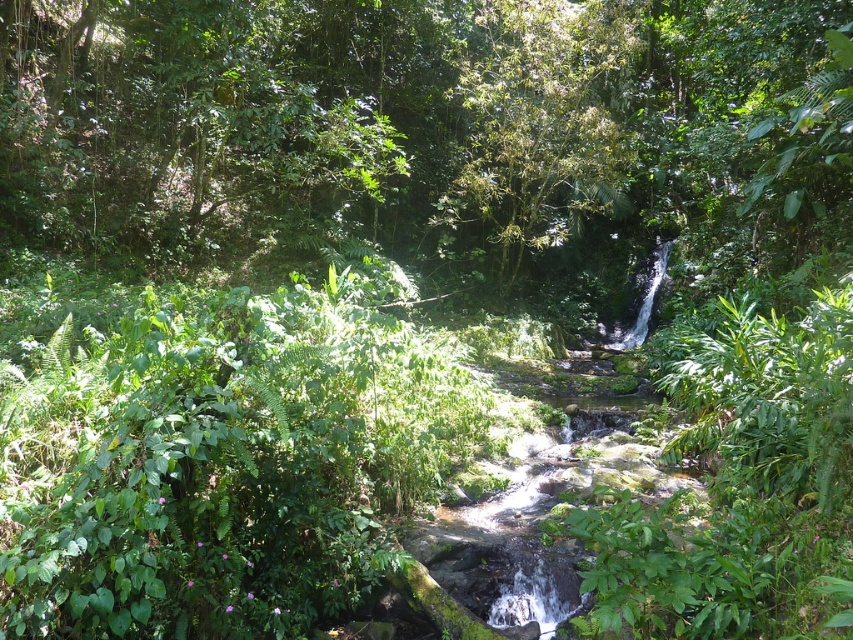
You are a hiker trying to navigate through the forest. You need to pass between the green leafy tree at center and the green leafy tree at upper center. Can you estimate if there is enough space for you to walk through?

The green leafy tree at center might be wider than the green leafy tree at upper center, so there might be sufficient space to walk between them, but it depends on the exact width difference and the path between them.